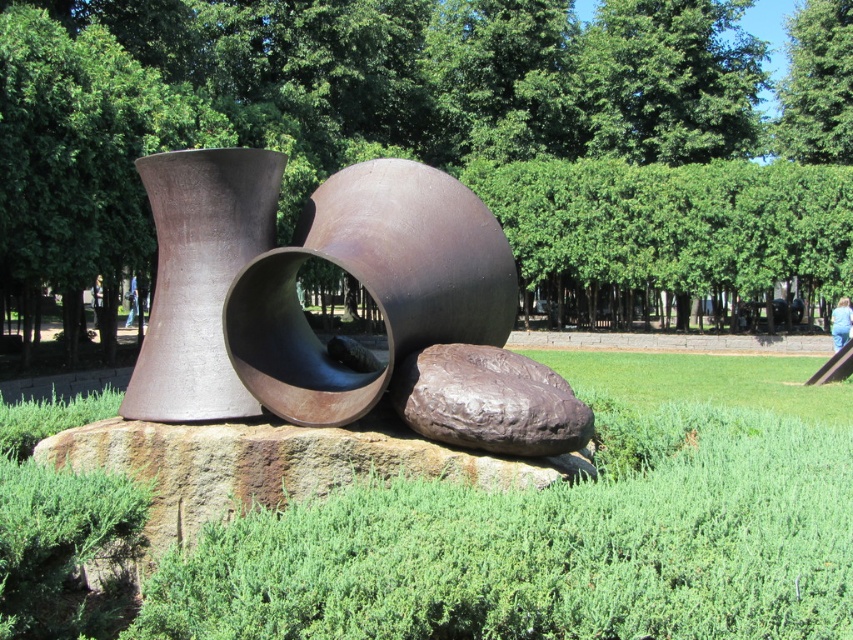
Between point (35, 88) and point (770, 579), which one is positioned behind?

The point (35, 88) is behind.

Looking at this image, is green leafy tree at center to the left of green grass at center from the viewer's perspective?

Correct, you'll find green leafy tree at center to the left of green grass at center.

What do you see at coordinates (430, 138) in the screenshot?
I see `green leafy tree at center` at bounding box center [430, 138].

Find the location of a particular element. The width and height of the screenshot is (853, 640). green leafy tree at center is located at coordinates (430, 138).

Is green leafy tree at center shorter than blue jeans at center?

In fact, green leafy tree at center may be taller than blue jeans at center.

Can you confirm if green leafy tree at center is bigger than blue jeans at center?

Indeed, green leafy tree at center has a larger size compared to blue jeans at center.

Identify the location of green leafy tree at center. The height and width of the screenshot is (640, 853). (430, 138).

Who is shorter, rusty metallic boulder at center or blue jeans at center?

rusty metallic boulder at center

Does rusty metallic boulder at center appear on the right side of blue jeans at center?

Correct, you'll find rusty metallic boulder at center to the right of blue jeans at center.

Is point (450, 426) positioned after point (132, 273)?

No, (450, 426) is in front of (132, 273).

Locate an element on the screen. rusty metallic boulder at center is located at coordinates (489, 401).